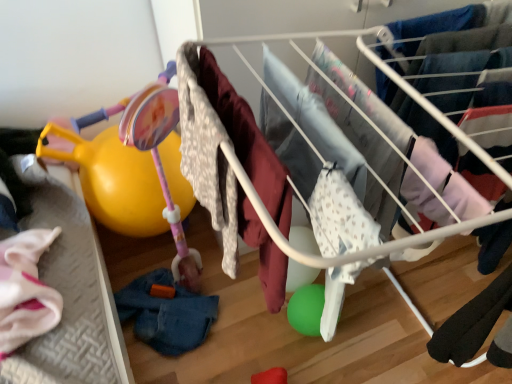
Find the location of a particular element. Image resolution: width=512 pixels, height=384 pixels. unoccupied region to the right of denim at lower left, which is the second clothing from front to back is located at coordinates (248, 320).